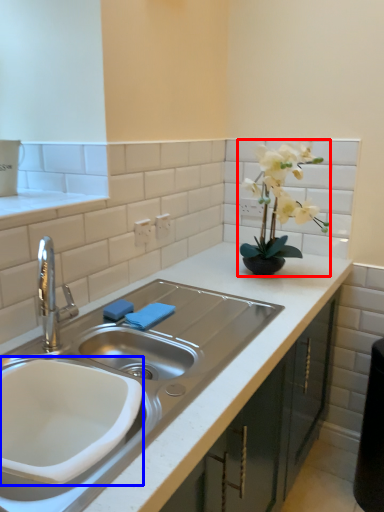
Question: Which point is closer to the camera, houseplant (highlighted by a red box) or sink (highlighted by a blue box)?

Choices:
 (A) houseplant
 (B) sink

Answer: (B)